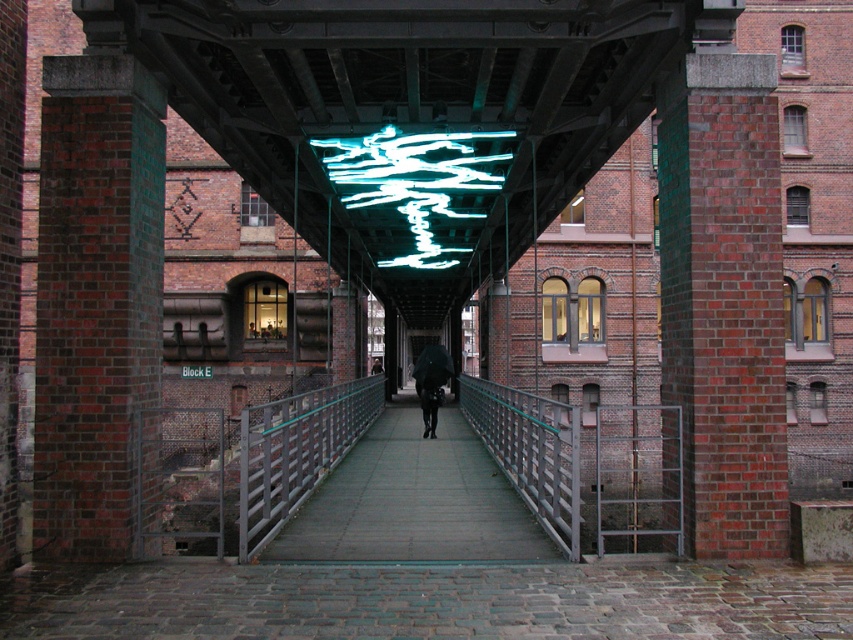
You are a delivery person carrying a large package that is 10 feet wide. You need to move through the walkway shown in the image. Can you pass under the translucent glass ceiling at center without tilting the package?

The translucent glass ceiling at center is 21.21 feet from the camera, which is more than enough height to allow a 10 feet wide package to pass underneath without tilting.

You are a delivery person with a cart that is 1.2 meters wide. You need to navigate through the walkway under the bridge. The walkway has a neon green glass at center and a metallic gray rail at center. Can your cart fit between them?

The neon green glass at center is smaller than the metallic gray rail at center, but the exact dimensions are not provided. However, since the metallic gray rail is at the center and the walkway is bordered by railings on both sides, the space between the railings might be sufficient for the cart. Without specific measurements, it is uncertain if the 1.2 meter wide cart can fit between the neon green glass at center and the metallic gray rail at center.